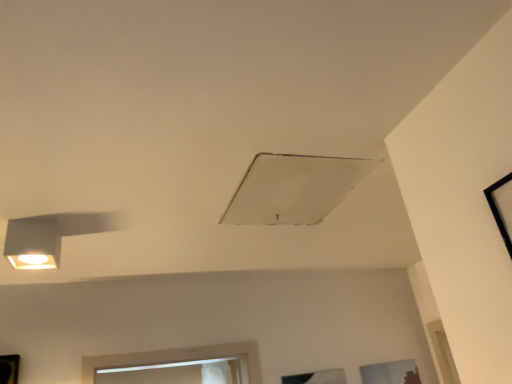
Question: Does black frame at upper right, the 3th window in the back-to-front sequence, have a lesser height compared to transparent glass window at lower center, which ranks as the 3th window in right-to-left order?

Choices:
 (A) no
 (B) yes

Answer: (A)

Question: From a real-world perspective, does black frame at upper right, the second window positioned from the left, sit lower than transparent glass window at lower center, which ranks as the 3th window in right-to-left order?

Choices:
 (A) no
 (B) yes

Answer: (A)

Question: Does black frame at upper right, the 1th window from the front, have a smaller size compared to transparent glass window at lower center, acting as the 2th window starting from the bottom?

Choices:
 (A) yes
 (B) no

Answer: (B)

Question: Does black frame at upper right, which is the 1th window in top-to-bottom order, have a lesser width compared to transparent glass window at lower center, which is the first window in left-to-right order?

Choices:
 (A) yes
 (B) no

Answer: (B)

Question: Is black frame at upper right, which is the 3th window in bottom-to-top order, directly adjacent to transparent glass window at lower center, which ranks as the 2th window in top-to-bottom order?

Choices:
 (A) no
 (B) yes

Answer: (A)

Question: Is black frame at upper right, the 1th window from the front, at the right side of transparent glass window at lower center, the second window from the back?

Choices:
 (A) yes
 (B) no

Answer: (A)

Question: Is transparent glass window at lower right, marked as the 1th window in a right-to-left arrangement, oriented away from matte white lamp at left?

Choices:
 (A) no
 (B) yes

Answer: (A)

Question: Is transparent glass window at lower right, marked as the 1th window in a right-to-left arrangement, taller than matte white lamp at left?

Choices:
 (A) no
 (B) yes

Answer: (B)

Question: From a real-world perspective, is transparent glass window at lower right, the 1th window positioned from the bottom, physically above matte white lamp at left?

Choices:
 (A) yes
 (B) no

Answer: (B)

Question: Considering the relative sizes of transparent glass window at lower right, the 1th window positioned from the bottom, and matte white lamp at left in the image provided, is transparent glass window at lower right, the 1th window positioned from the bottom, thinner than matte white lamp at left?

Choices:
 (A) no
 (B) yes

Answer: (B)

Question: Is transparent glass window at lower right, marked as the 1th window in a right-to-left arrangement, behind matte white lamp at left?

Choices:
 (A) yes
 (B) no

Answer: (A)

Question: From the image's perspective, is transparent glass window at lower right, which appears as the third window when viewed from the left, located above matte white lamp at left?

Choices:
 (A) yes
 (B) no

Answer: (B)

Question: Is matte white lamp at left not close to white matte exhaust hood at center?

Choices:
 (A) yes
 (B) no

Answer: (B)